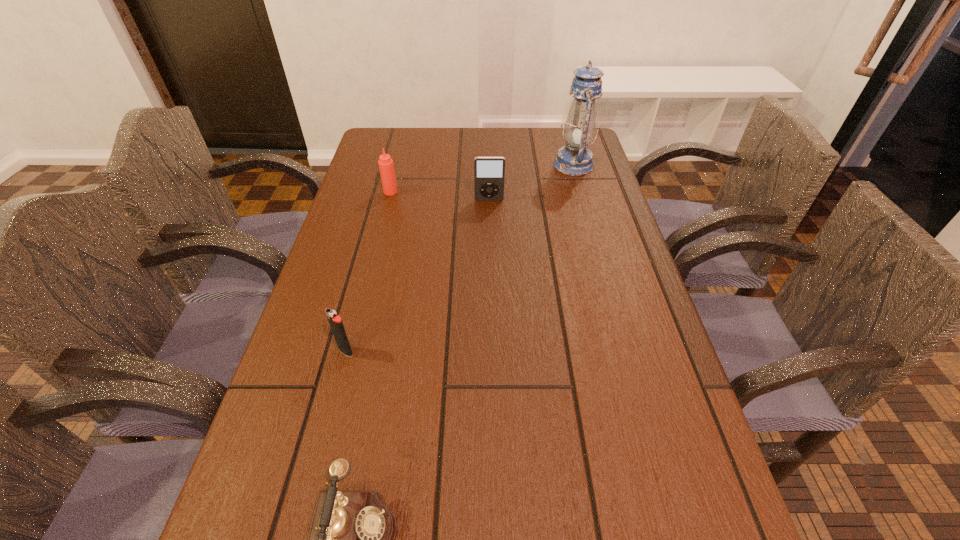
The image size is (960, 540). Find the location of `free space at the far left corner of the desktop`. free space at the far left corner of the desktop is located at coordinates (405, 157).

This screenshot has width=960, height=540. I want to click on empty space between the Tabasco sauce and the third farthest object, so click(x=440, y=196).

You are a GUI agent. You are given a task and a screenshot of the screen. Output one action in this format:
    pyautogui.click(x=<x>, y=<y>)
    Task: Click on the free spot between the Tabasco sauce and the iPod
    The width and height of the screenshot is (960, 540).
    Given the screenshot: What is the action you would take?
    pyautogui.click(x=440, y=196)

Where is `unoccupied position between the fourth farthest object and the third nearest object`? unoccupied position between the fourth farthest object and the third nearest object is located at coordinates (418, 275).

Identify the location of free area in between the tallest object and the fourth farthest object. The width and height of the screenshot is (960, 540). (460, 258).

Where is `empty location between the third nearest object and the igniter`? The image size is (960, 540). empty location between the third nearest object and the igniter is located at coordinates [418, 275].

The height and width of the screenshot is (540, 960). I want to click on vacant area between the farthest object and the third farthest object, so click(531, 183).

Locate an element on the screen. The height and width of the screenshot is (540, 960). object that stands as the third closest to the Tabasco sauce is located at coordinates (336, 324).

Identify the location of object that is the second closest to the nearest object. (489, 172).